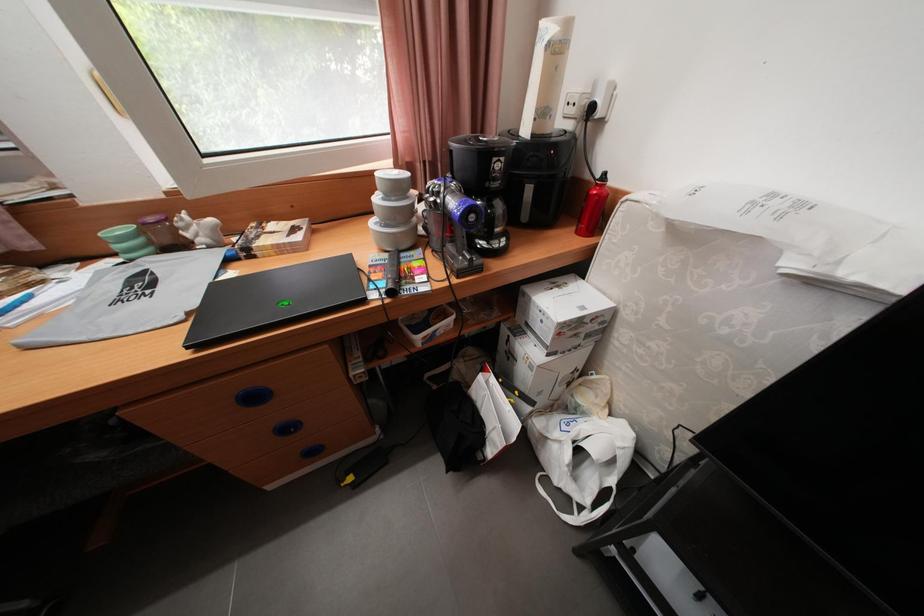
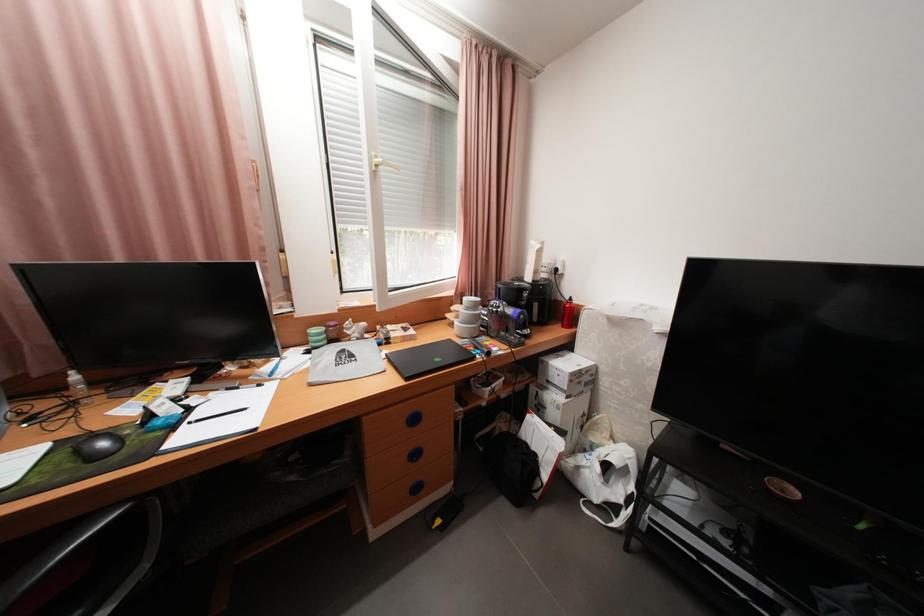
Question: Based on the continuous images, in which direction is the camera rotating? Reply with the corresponding letter.

Choices:
 (A) Left
 (B) Right
 (C) Up
 (D) Down

Answer: (C)